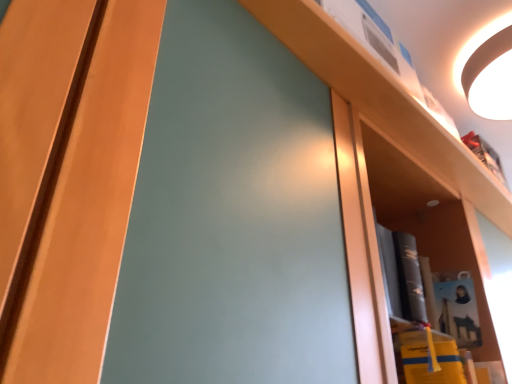
Where is `white glossy lampshade at upper right`? The width and height of the screenshot is (512, 384). white glossy lampshade at upper right is located at coordinates (489, 73).

What do you see at coordinates (489, 73) in the screenshot? This screenshot has width=512, height=384. I see `white glossy lampshade at upper right` at bounding box center [489, 73].

The image size is (512, 384). In order to click on white glossy lampshade at upper right in this screenshot , I will do `click(489, 73)`.